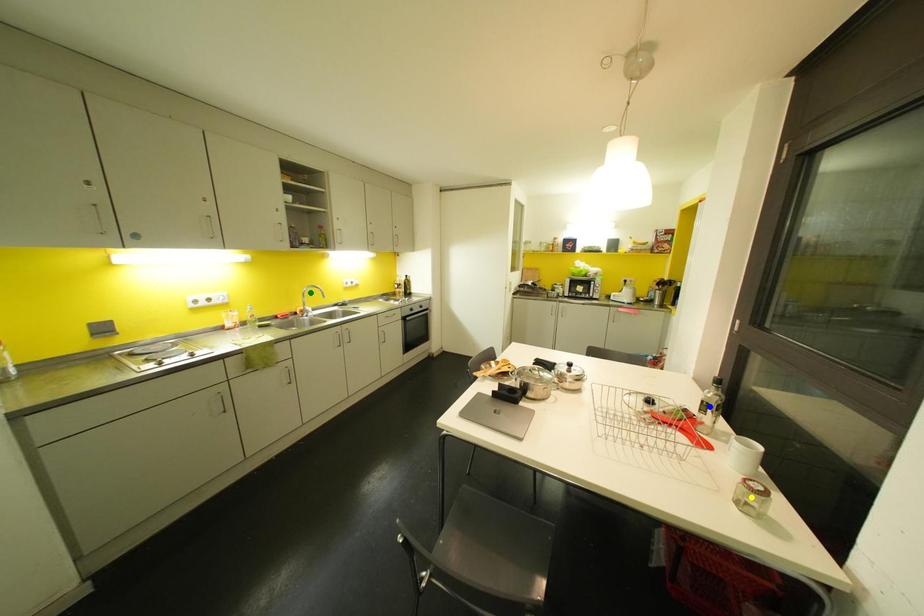
Order these from nearest to farthest:
- yellow point
- green point
- blue point

yellow point, blue point, green point